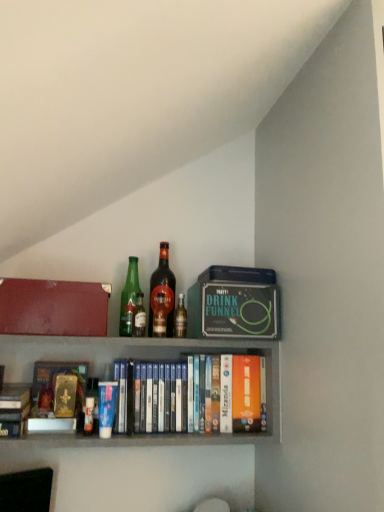
Question: In terms of size, does blue matte paperback book at lower left, which is the second paperback book from back to front, appear bigger or smaller than green glass bottle at center, which is the 2th bottle in left-to-right order?

Choices:
 (A) big
 (B) small

Answer: (A)

Question: In the image, is blue matte paperback book at lower left, the second paperback book viewed from the right, positioned in front of or behind green glass bottle at center, the third bottle positioned from the right?

Choices:
 (A) behind
 (B) front

Answer: (B)

Question: Estimate the real-world distances between objects in this image. Which object is farther from the matte black drink funnel at upper center, the second paperback book from the front?

Choices:
 (A) matte red box at upper left
 (B) translucent glass bottle at center, the first bottle when ordered from right to left
 (C) brown glass bottle at center, acting as the 3th bottle starting from the left
 (D) wooden books at center
 (E) green glass bottle at center, arranged as the 4th bottle when viewed from the right

Answer: (A)

Question: Which is nearer to the green glass bottle at center, the third bottle positioned from the right?

Choices:
 (A) brown glass bottle at center, the 2th bottle in the right-to-left sequence
 (B) wooden books at center
 (C) matte black drink funnel at upper center, which is counted as the 1th paperback book, starting from the top
 (D) blue matte paperback book at lower left, positioned as the 2th paperback book in top-to-bottom order
 (E) green glass bottle at center, which is the first bottle in left-to-right order

Answer: (E)